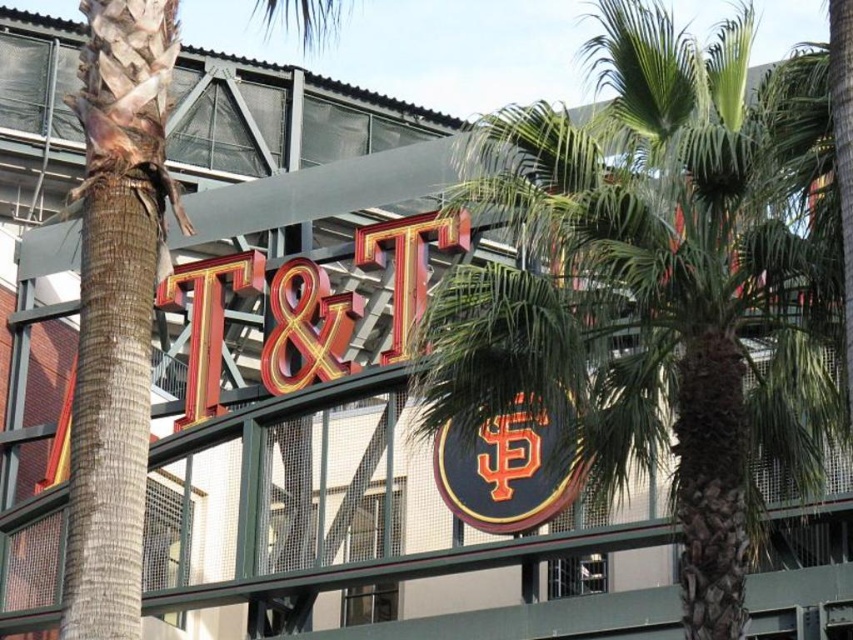
Is point (503, 289) less distant than point (167, 81)?

No, it is behind (167, 81).

The image size is (853, 640). Find the location of `green leafy palm tree at center`. green leafy palm tree at center is located at coordinates (662, 282).

Image resolution: width=853 pixels, height=640 pixels. What are the coordinates of `green leafy palm tree at center` in the screenshot? It's located at (662, 282).

How far apart are green leafy palm tree at center and orange glossy logo at center?

green leafy palm tree at center is 13.93 meters from orange glossy logo at center.

Can you confirm if green leafy palm tree at center is positioned to the left of orange glossy logo at center?

In fact, green leafy palm tree at center is to the right of orange glossy logo at center.

Does point (514, 193) come closer to viewer compared to point (521, 477)?

Yes, it is in front of point (521, 477).

Identify the location of green leafy palm tree at center. 662,282.

Can you confirm if green leafy palm tree at left is wider than orange glossy logo at center?

Correct, the width of green leafy palm tree at left exceeds that of orange glossy logo at center.

Is point (115, 248) positioned before point (556, 433)?

Yes, point (115, 248) is in front of point (556, 433).

Is point (177, 49) farther from viewer compared to point (502, 480)?

No, (177, 49) is in front of (502, 480).

I want to click on green leafy palm tree at left, so click(x=115, y=305).